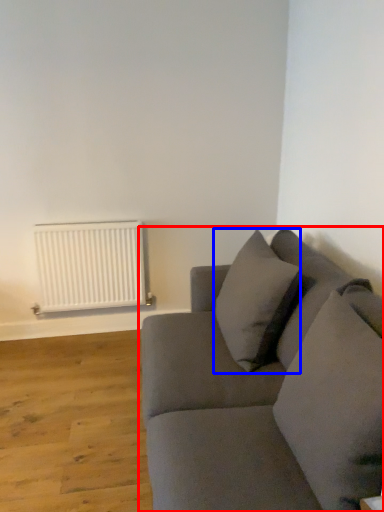
Question: Which point is further to the camera, studio couch (highlighted by a red box) or pillow (highlighted by a blue box)?

Choices:
 (A) studio couch
 (B) pillow

Answer: (B)